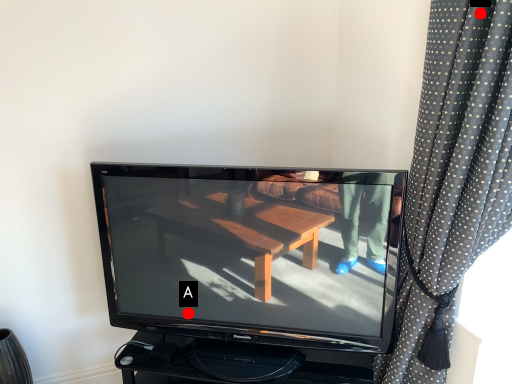
Question: Two points are circled on the image, labeled by A and B beside each circle. Which of the following is the farthest from the observer?

Choices:
 (A) A is further
 (B) B is further

Answer: (A)